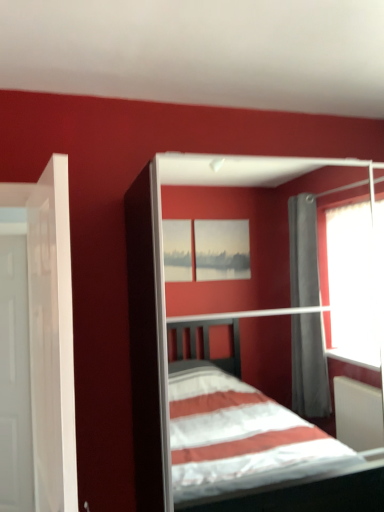
What is the approximate height of white glossy door at left, which ranks as the 2th door in left-to-right order?

white glossy door at left, which ranks as the 2th door in left-to-right order, is 4.24 feet tall.

Locate an element on the screen. This screenshot has height=512, width=384. white glossy door at left, which ranks as the 2th door in left-to-right order is located at coordinates (50, 333).

Find the location of a particular element. The width and height of the screenshot is (384, 512). white matte bed at center is located at coordinates (165, 296).

Measure the distance between white matte bed at center and camera.

white matte bed at center and camera are 3.01 meters apart.

At what (x,y) coordinates should I click in order to perform the action: click on white glossy door at left, the first door positioned from the back. Please return your answer as a coordinate pair (x, y). The height and width of the screenshot is (512, 384). Looking at the image, I should click on (15, 379).

At what (x,y) coordinates should I click in order to perform the action: click on door located in front of the white glossy door at left, positioned as the 2th door in right-to-left order. Please return your answer as a coordinate pair (x, y). The width and height of the screenshot is (384, 512). Looking at the image, I should click on (50, 333).

From their relative heights in the image, would you say white glossy door at left, placed as the 1th door when sorted from right to left, is taller or shorter than white glossy door at left, marked as the second door in a front-to-back arrangement?

In the image, white glossy door at left, placed as the 1th door when sorted from right to left, appears to be shorter than white glossy door at left, marked as the second door in a front-to-back arrangement.

Is white glossy door at left, which ranks as the 2th door in left-to-right order, smaller than white glossy door at left, marked as the second door in a front-to-back arrangement?

Actually, white glossy door at left, which ranks as the 2th door in left-to-right order, might be larger than white glossy door at left, marked as the second door in a front-to-back arrangement.

Is white glossy door at left, which ranks as the 2th door in left-to-right order, at the right side of white glossy door at left, positioned as the 2th door in right-to-left order?

Yes, white glossy door at left, which ranks as the 2th door in left-to-right order, is to the right of white glossy door at left, positioned as the 2th door in right-to-left order.

Identify the location of bed in front of the white glossy door at left, positioned as the 2th door in right-to-left order. (165, 296).

In the scene shown: From the image's perspective, between white glossy door at left, marked as the second door in a front-to-back arrangement, and white matte bed at center, who is located below?

white glossy door at left, marked as the second door in a front-to-back arrangement, appears lower in the image.

Considering the positions of objects white glossy door at left, marked as the second door in a front-to-back arrangement, and white matte bed at center in the image provided, who is more to the right, white glossy door at left, marked as the second door in a front-to-back arrangement, or white matte bed at center?

white matte bed at center.

From the picture: Which is closer to the camera, (161, 396) or (24, 401)?

Clearly, point (161, 396) is closer to the camera than point (24, 401).

Does white matte bed at center turn towards white glossy door at left, marked as the second door in a front-to-back arrangement?

No, white matte bed at center is not aimed at white glossy door at left, marked as the second door in a front-to-back arrangement.

From a real-world perspective, which object stands above the other?

white matte bed at center.

Consider the image. Is white matte bed at center completely or partially outside of white glossy door at left, marked as the second door in a front-to-back arrangement?

Absolutely, white matte bed at center is external to white glossy door at left, marked as the second door in a front-to-back arrangement.

In terms of width, does white glossy door at left, acting as the 1th door starting from the left, look wider or thinner when compared to white glossy door at left, placed as the 1th door when sorted from right to left?

Clearly, white glossy door at left, acting as the 1th door starting from the left, has less width compared to white glossy door at left, placed as the 1th door when sorted from right to left.

Considering their positions, is white glossy door at left, acting as the 1th door starting from the left, located in front of or behind white glossy door at left, placed as the 1th door when sorted from right to left?

white glossy door at left, acting as the 1th door starting from the left, is behind white glossy door at left, placed as the 1th door when sorted from right to left.

Would you say white glossy door at left, the first door positioned from the back, is a long distance from white glossy door at left, placed as the 1th door when sorted from right to left?

Yes, white glossy door at left, the first door positioned from the back, is far from white glossy door at left, placed as the 1th door when sorted from right to left.

What's the angular difference between white glossy door at left, which is counted as the 1th door, starting from the front, and white matte bed at center's facing directions?

The facing directions of white glossy door at left, which is counted as the 1th door, starting from the front, and white matte bed at center are 81.2 degrees apart.

From a real-world perspective, which object rests below the other?

In real-world perspective, white matte bed at center is lower.

Is white glossy door at left, placed as the 1th door when sorted from right to left, positioned with its back to white matte bed at center?

That's right, white glossy door at left, placed as the 1th door when sorted from right to left, is facing away from white matte bed at center.

Which of these two, white glossy door at left, placed as the 1th door when sorted from right to left, or white matte bed at center, stands shorter?

With less height is white glossy door at left, placed as the 1th door when sorted from right to left.

Which is closer to the camera, (133, 189) or (30, 189)?

The point (133, 189) is closer.

Considering the relative sizes of white matte bed at center and white glossy door at left, which is counted as the 1th door, starting from the front, in the image provided, is white matte bed at center bigger than white glossy door at left, which is counted as the 1th door, starting from the front,?

Correct, white matte bed at center is larger in size than white glossy door at left, which is counted as the 1th door, starting from the front.

Who is more distant, white matte bed at center or white glossy door at left, positioned as the second door in back-to-front order?

white matte bed at center is behind.

From the picture: Which of these two, white matte bed at center or white glossy door at left, placed as the 1th door when sorted from right to left, stands shorter?

white glossy door at left, placed as the 1th door when sorted from right to left.

Locate an element on the screen. The width and height of the screenshot is (384, 512). door above the white glossy door at left, positioned as the 2th door in right-to-left order (from a real-world perspective) is located at coordinates (50, 333).

Which door is the 2nd one when counting from the left side of the white matte bed at center? Please provide its 2D coordinates.

[(15, 379)]

Which object lies nearer to the anchor point white matte bed at center, white glossy door at left, the first door positioned from the back, or white glossy door at left, placed as the 1th door when sorted from right to left?

The object closer to white matte bed at center is white glossy door at left, the first door positioned from the back.

Looking at the image, which one is located closer to white glossy door at left, positioned as the 2th door in right-to-left order, white glossy door at left, which ranks as the 2th door in left-to-right order, or white matte bed at center?

white glossy door at left, which ranks as the 2th door in left-to-right order, is closer to white glossy door at left, positioned as the 2th door in right-to-left order.

When comparing their distances from white glossy door at left, positioned as the second door in back-to-front order, does white matte bed at center or white glossy door at left, the first door positioned from the back, seem closer?

The object closer to white glossy door at left, positioned as the second door in back-to-front order, is white glossy door at left, the first door positioned from the back.

Which object lies further to the anchor point white glossy door at left, which is counted as the 1th door, starting from the front, white glossy door at left, the first door positioned from the back, or white matte bed at center?

white matte bed at center lies further to white glossy door at left, which is counted as the 1th door, starting from the front, than the other object.

Estimate the real-world distances between objects in this image. Which object is further from white matte bed at center, white glossy door at left, positioned as the second door in back-to-front order, or white glossy door at left, the first door positioned from the back?

white glossy door at left, positioned as the second door in back-to-front order, is positioned further to the anchor white matte bed at center.

When comparing their distances from white glossy door at left, marked as the second door in a front-to-back arrangement, does white matte bed at center or white glossy door at left, placed as the 1th door when sorted from right to left, seem further?

Among the two, white matte bed at center is located further to white glossy door at left, marked as the second door in a front-to-back arrangement.

Locate an element on the screen. Image resolution: width=384 pixels, height=512 pixels. bed between white glossy door at left, placed as the 1th door when sorted from right to left, and white glossy door at left, the first door positioned from the back, from front to back is located at coordinates coord(165,296).